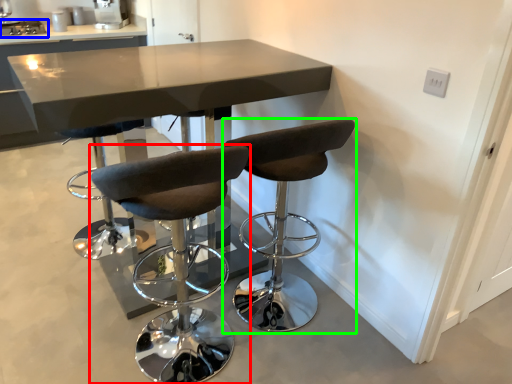
Question: Considering the real-world distances, which object is farthest from chair (highlighted by a red box)? appliance (highlighted by a blue box) or chair (highlighted by a green box)?

Choices:
 (A) appliance
 (B) chair

Answer: (A)